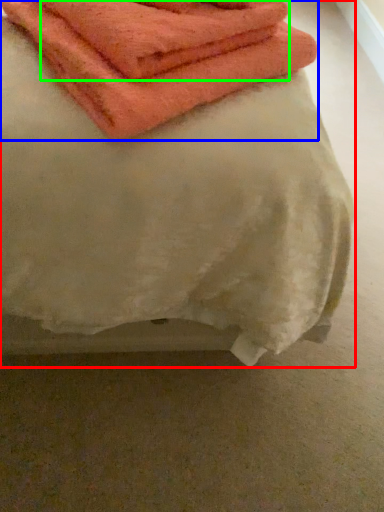
Question: Which object is positioned farthest from towel (highlighted by a red box)? Select from towel (highlighted by a blue box) and towel (highlighted by a green box).

Choices:
 (A) towel
 (B) towel

Answer: (B)